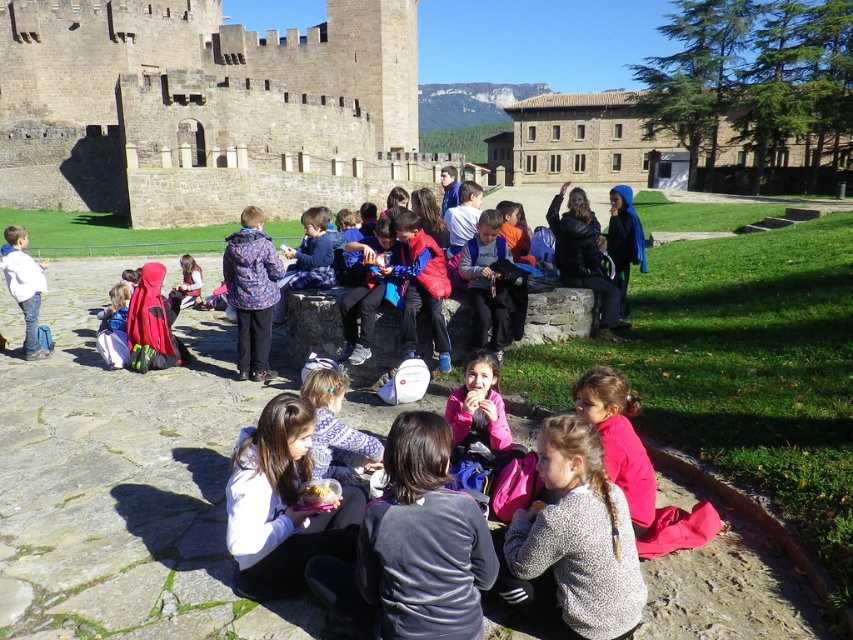
Looking at this image, is brown stone fort at upper left below white fleece jacket at lower center?

No.

Based on the photo, measure the distance between point (x=7, y=96) and camera.

Point (x=7, y=96) and camera are 395.18 feet apart.

Identify the location of brown stone fort at upper left. (204, 108).

Is brown stone fort at upper left bigger than brown stone building at center?

Incorrect, brown stone fort at upper left is not larger than brown stone building at center.

Between point (103, 100) and point (556, 161), which one is positioned behind?

Positioned behind is point (556, 161).

Who is more distant from viewer, [300,177] or [486,141]?

Point [486,141]

At what (x,y) coordinates should I click in order to perform the action: click on brown stone fort at upper left. Please return your answer as a coordinate pair (x, y). Image resolution: width=853 pixels, height=640 pixels. Looking at the image, I should click on (204, 108).

Which of these two, speckled gray sweater at lower right or brown stone building at center, stands shorter?

With less height is speckled gray sweater at lower right.

Can you confirm if speckled gray sweater at lower right is positioned to the left of brown stone building at center?

Yes, speckled gray sweater at lower right is to the left of brown stone building at center.

The image size is (853, 640). What are the coordinates of `speckled gray sweater at lower right` in the screenshot? It's located at (573, 541).